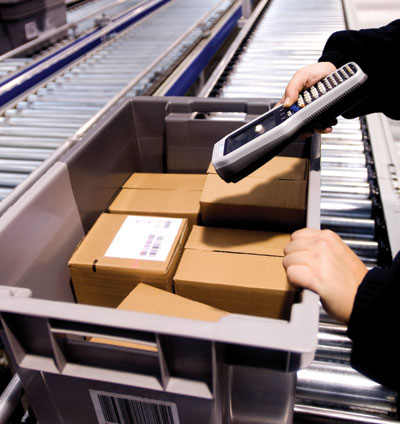
Where is `tray`? tray is located at coordinates (56, 223).